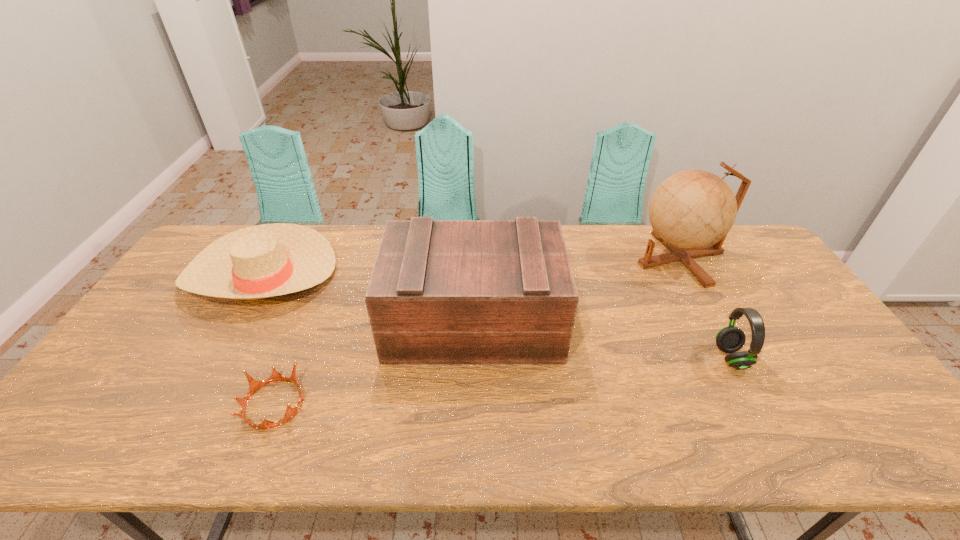
This screenshot has width=960, height=540. What are the coordinates of `free space located 0.190m on the left of the fourth shortest object` in the screenshot? It's located at (322, 321).

Locate an element on the screen. This screenshot has width=960, height=540. free space located on the ear cups of the headset is located at coordinates (640, 357).

Where is `vacant space located on the ear cups of the headset`? vacant space located on the ear cups of the headset is located at coordinates (644, 357).

Identify the location of free space located on the ear cups of the headset. The height and width of the screenshot is (540, 960). (629, 357).

Where is `free space located 0.330m on the front of the second shortest object`? free space located 0.330m on the front of the second shortest object is located at coordinates (178, 420).

Where is `free spot located on the left of the nearest object`? This screenshot has height=540, width=960. free spot located on the left of the nearest object is located at coordinates (113, 404).

In order to click on globe that is at the far edge in this screenshot , I will do `click(691, 212)`.

Find the location of `sunhat present at the far edge`. sunhat present at the far edge is located at coordinates (267, 260).

In order to click on object that is at the near edge in this screenshot , I will do `click(254, 385)`.

The height and width of the screenshot is (540, 960). In order to click on object positioned at the left edge in this screenshot , I will do coord(267,260).